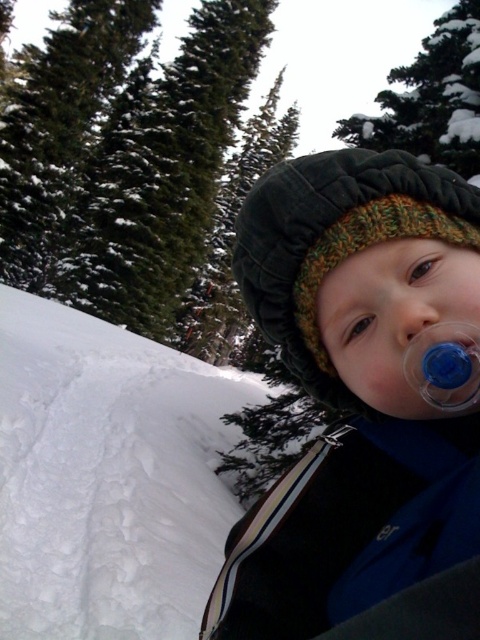
Question: Is blue rubber pacifier at center above matte plastic nose at center?

Choices:
 (A) yes
 (B) no

Answer: (B)

Question: Which object is positioned closest to the knitted woolen hat at center?

Choices:
 (A) matte plastic nose at center
 (B) white fluffy snow at lower left

Answer: (A)

Question: Which point is farther to the camera?

Choices:
 (A) (427, 324)
 (B) (459, 272)

Answer: (B)

Question: Does knitted woolen hat at center appear over matte plastic nose at center?

Choices:
 (A) yes
 (B) no

Answer: (A)

Question: Can you confirm if knitted woolen hat at center is wider than matte plastic nose at center?

Choices:
 (A) no
 (B) yes

Answer: (B)

Question: Estimate the real-world distances between objects in this image. Which object is closer to the matte plastic nose at center?

Choices:
 (A) white fluffy snow at lower left
 (B) blue rubber pacifier at center
 (C) knitted woolen hat at center

Answer: (B)